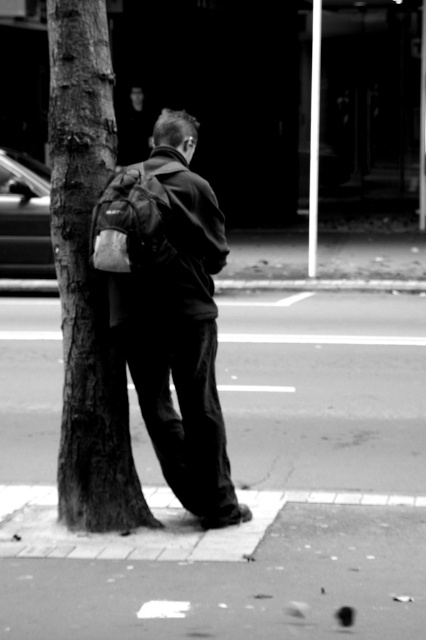
Question: Which point is closer to the camera?

Choices:
 (A) (52, 76)
 (B) (363, 392)

Answer: (A)

Question: Estimate the real-world distances between objects in this image. Which object is farther from the matte black backpack at left?

Choices:
 (A) smooth bark tree at center
 (B) smooth concrete pavement at center

Answer: (B)

Question: Is smooth concrete pavement at center below smooth bark tree at center?

Choices:
 (A) yes
 (B) no

Answer: (A)

Question: Is smooth concrete pavement at center to the right of matte black backpack at left from the viewer's perspective?

Choices:
 (A) yes
 (B) no

Answer: (B)

Question: Which of the following is the closest to the observer?

Choices:
 (A) matte black backpack at left
 (B) smooth bark tree at center

Answer: (A)

Question: Can you confirm if smooth concrete pavement at center is bigger than smooth bark tree at center?

Choices:
 (A) no
 (B) yes

Answer: (B)